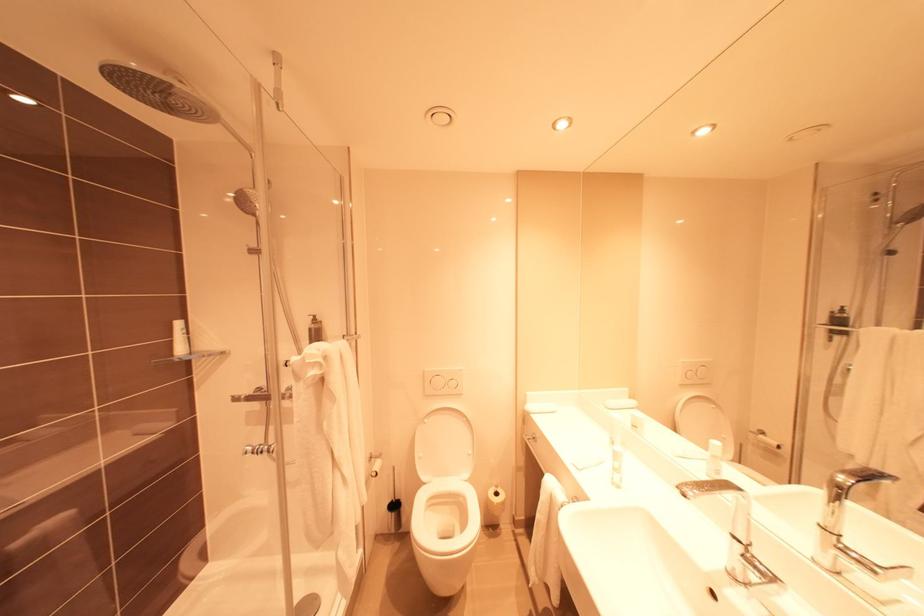
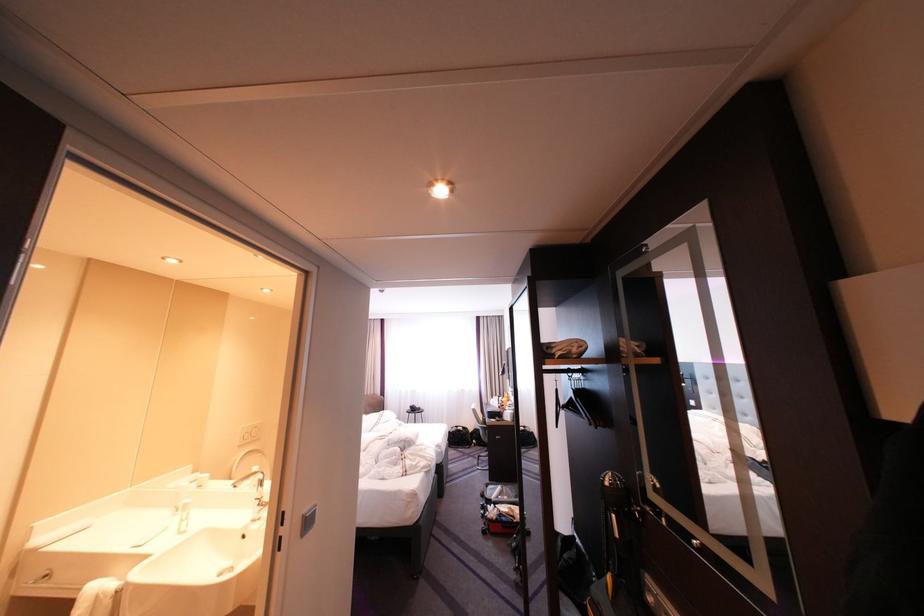
Where in the second image is the point corresponding to the point at 696,363 from the first image?

(254, 429)